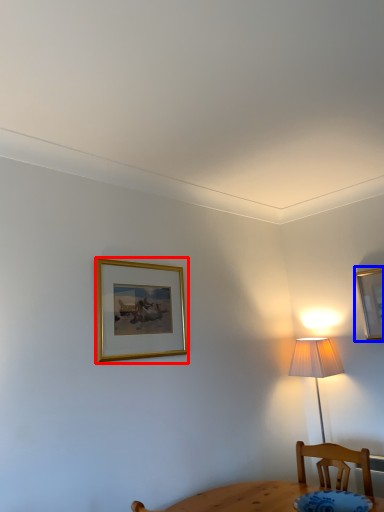
Question: Which object is closer to the camera taking this photo, picture frame (highlighted by a red box) or picture frame (highlighted by a blue box)?

Choices:
 (A) picture frame
 (B) picture frame

Answer: (A)